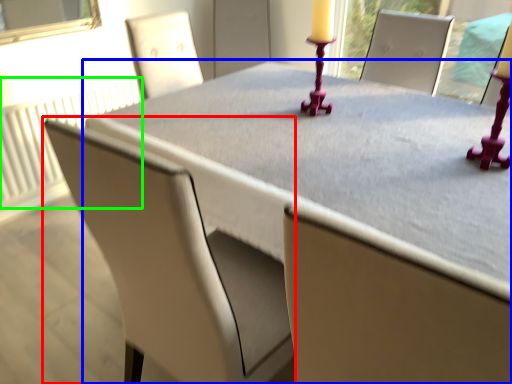
Question: Which object is the closest to the chair (highlighted by a red box)? Choose among these: table (highlighted by a blue box) or radiator (highlighted by a green box).

Choices:
 (A) table
 (B) radiator

Answer: (A)